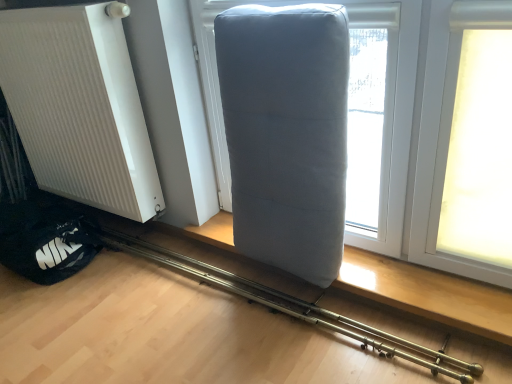
Question: Considering the relative sizes of white ribbed radiator at left and gray fabric pillow at center in the image provided, is white ribbed radiator at left bigger than gray fabric pillow at center?

Choices:
 (A) no
 (B) yes

Answer: (B)

Question: From a real-world perspective, is white ribbed radiator at left located higher than gray fabric pillow at center?

Choices:
 (A) no
 (B) yes

Answer: (B)

Question: Is white ribbed radiator at left oriented away from gray fabric pillow at center?

Choices:
 (A) no
 (B) yes

Answer: (A)

Question: From a real-world perspective, does white ribbed radiator at left sit lower than gray fabric pillow at center?

Choices:
 (A) no
 (B) yes

Answer: (A)

Question: Does white ribbed radiator at left appear on the left side of gray fabric pillow at center?

Choices:
 (A) yes
 (B) no

Answer: (A)

Question: Considering the relative positions of white ribbed radiator at left and gray fabric pillow at center in the image provided, is white ribbed radiator at left to the left or to the right of gray fabric pillow at center?

Choices:
 (A) left
 (B) right

Answer: (A)

Question: From a real-world perspective, is white ribbed radiator at left above or below gray fabric pillow at center?

Choices:
 (A) below
 (B) above

Answer: (B)

Question: In terms of size, does white ribbed radiator at left appear bigger or smaller than gray fabric pillow at center?

Choices:
 (A) big
 (B) small

Answer: (A)

Question: Would you say white ribbed radiator at left is inside or outside gray fabric pillow at center?

Choices:
 (A) inside
 (B) outside

Answer: (B)

Question: From a real-world perspective, is matte gray pillow at center positioned above or below gray fabric pillow at center?

Choices:
 (A) above
 (B) below

Answer: (B)

Question: Is matte gray pillow at center bigger or smaller than gray fabric pillow at center?

Choices:
 (A) big
 (B) small

Answer: (B)

Question: Is point (464, 379) positioned closer to the camera than point (224, 122)?

Choices:
 (A) farther
 (B) closer

Answer: (B)

Question: From the image's perspective, is matte gray pillow at center located above or below gray fabric pillow at center?

Choices:
 (A) below
 (B) above

Answer: (A)

Question: Is point (265, 178) positioned closer to the camera than point (133, 77)?

Choices:
 (A) closer
 (B) farther

Answer: (A)

Question: In terms of width, does gray fabric pillow at center look wider or thinner when compared to white ribbed radiator at left?

Choices:
 (A) wide
 (B) thin

Answer: (A)